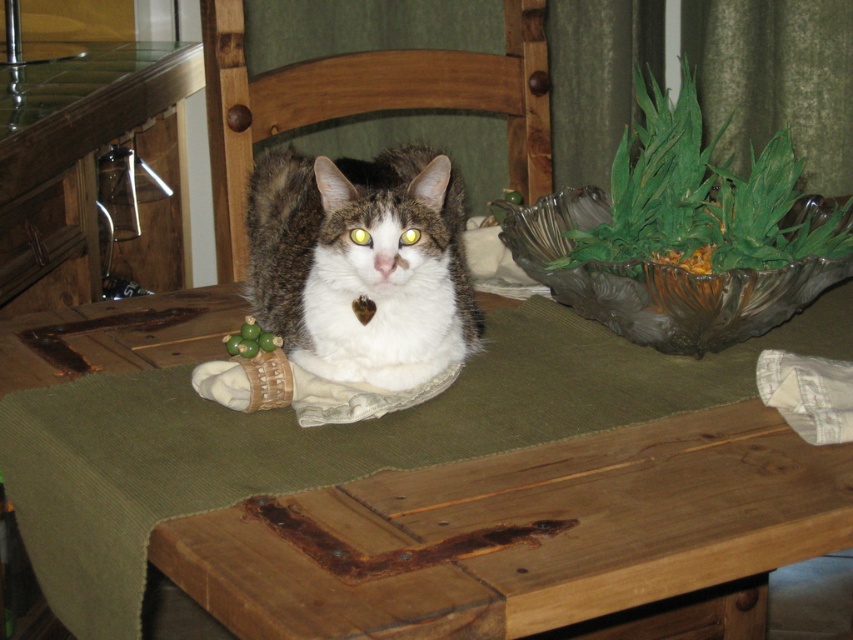
How far apart are wooden table at left and wooden chair at center?

wooden table at left and wooden chair at center are 21.07 inches apart.

Locate an element on the screen. wooden table at left is located at coordinates (86, 170).

Is point (332, 284) closer to camera compared to point (0, 285)?

Yes, point (332, 284) is closer to viewer.

Locate an element on the screen. The height and width of the screenshot is (640, 853). fuzzy brown and white cat at center is located at coordinates (363, 262).

Is wooden table at center in front of wooden chair at center?

Yes, it is in front of wooden chair at center.

Consider the image. Does wooden table at center have a lesser height compared to wooden chair at center?

Yes, wooden table at center is shorter than wooden chair at center.

The width and height of the screenshot is (853, 640). In order to click on wooden table at center in this screenshot , I will do `click(326, 436)`.